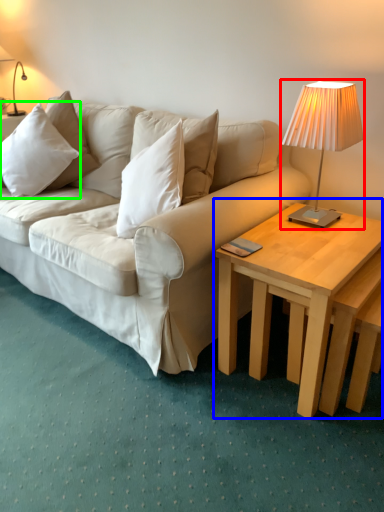
Question: Estimate the real-world distances between objects in this image. Which object is closer to lamp (highlighted by a red box), coffee table (highlighted by a blue box) or pillow (highlighted by a green box)?

Choices:
 (A) coffee table
 (B) pillow

Answer: (A)